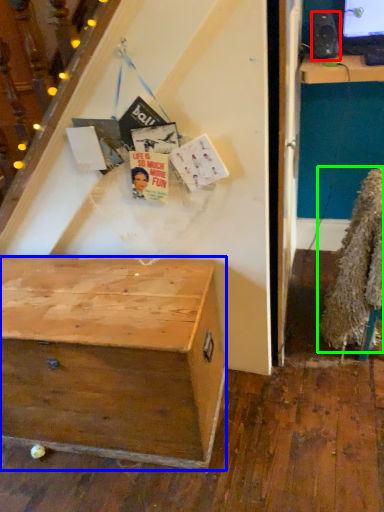
Question: Which object is positioned farthest from loudspeaker (highlighted by a red box)? Select from desk (highlighted by a blue box) and fur coat (highlighted by a green box).

Choices:
 (A) desk
 (B) fur coat

Answer: (A)